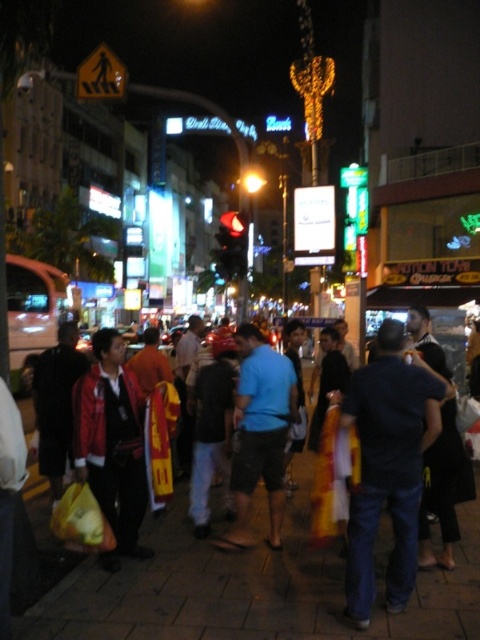
Does smooth concrete pavement at center have a lesser height compared to dark blue jeans at center?

Yes.

Can you confirm if smooth concrete pavement at center is taller than dark blue jeans at center?

Incorrect, smooth concrete pavement at center's height is not larger of dark blue jeans at center's.

This screenshot has height=640, width=480. What are the coordinates of `smooth concrete pavement at center` in the screenshot? It's located at (252, 586).

In the scene shown: Between dark blue jeans at center and blue cotton shirt at center, which one appears on the right side from the viewer's perspective?

dark blue jeans at center is more to the right.

Who is more distant from viewer, (x=368, y=500) or (x=251, y=442)?

Positioned behind is point (x=251, y=442).

Is point (379, 420) positioned in front of point (242, 525)?

Yes, point (379, 420) is closer to viewer.

The width and height of the screenshot is (480, 640). Find the location of `dark blue jeans at center`. dark blue jeans at center is located at coordinates (387, 467).

Does smooth concrete pavement at center appear under blue cotton shirt at center?

Indeed, smooth concrete pavement at center is positioned under blue cotton shirt at center.

Between smooth concrete pavement at center and blue cotton shirt at center, which one has more height?

blue cotton shirt at center is taller.

Find the location of `smooth concrete pavement at center`. smooth concrete pavement at center is located at coordinates (252, 586).